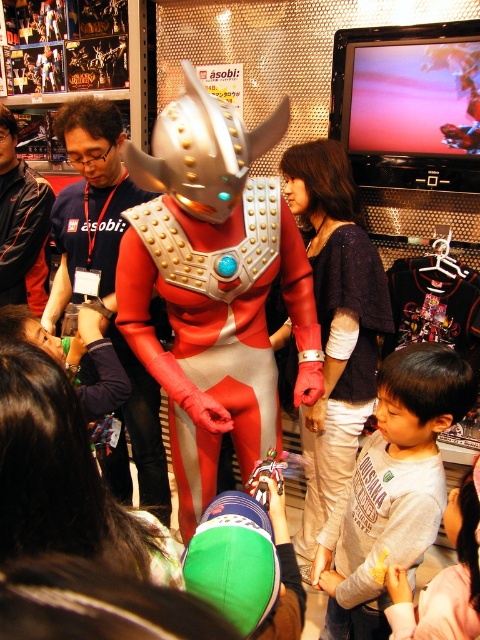
Question: Based on their relative distances, which object is farther from the dark blue fabric shirt at center?

Choices:
 (A) shiny metallic suit at center
 (B) matte red costume at center
 (C) gray cotton shirt at lower right
 (D) metallic silver armor at center

Answer: (C)

Question: Can you confirm if metallic silver armor at center is smaller than dark blue fabric shirt at center?

Choices:
 (A) yes
 (B) no

Answer: (B)

Question: Does gray cotton shirt at lower right appear on the right side of matte red costume at center?

Choices:
 (A) no
 (B) yes

Answer: (B)

Question: Is matte red costume at center positioned before metallic silver armor at center?

Choices:
 (A) yes
 (B) no

Answer: (A)

Question: Which object appears farthest from the camera in this image?

Choices:
 (A) metallic silver armor at center
 (B) gray cotton shirt at lower right
 (C) dark blue fabric shirt at center
 (D) matte red costume at center

Answer: (C)

Question: Among these points, which one is nearest to the camera?

Choices:
 (A) (336, 630)
 (B) (260, 408)
 (C) (112, 212)

Answer: (B)